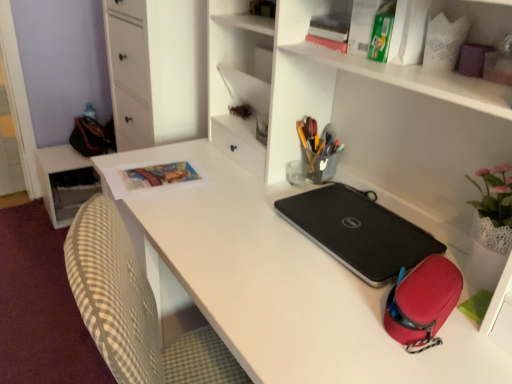
I want to click on vacant region above matte paper book at upper left (from a real-world perspective), so click(160, 173).